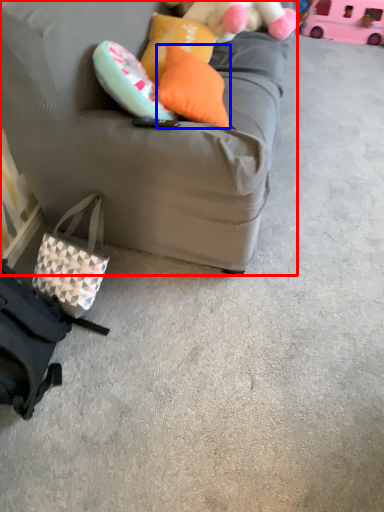
Question: Which point is closer to the camera, studio couch (highlighted by a red box) or pillow (highlighted by a blue box)?

Choices:
 (A) studio couch
 (B) pillow

Answer: (A)